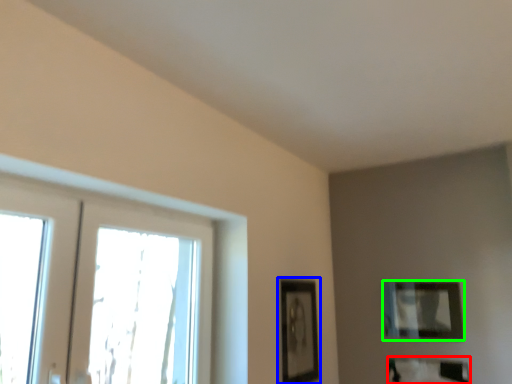
Question: Estimate the real-world distances between objects in this image. Which object is farther from picture frame (highlighted by a red box), picture frame (highlighted by a blue box) or picture frame (highlighted by a green box)?

Choices:
 (A) picture frame
 (B) picture frame

Answer: (A)